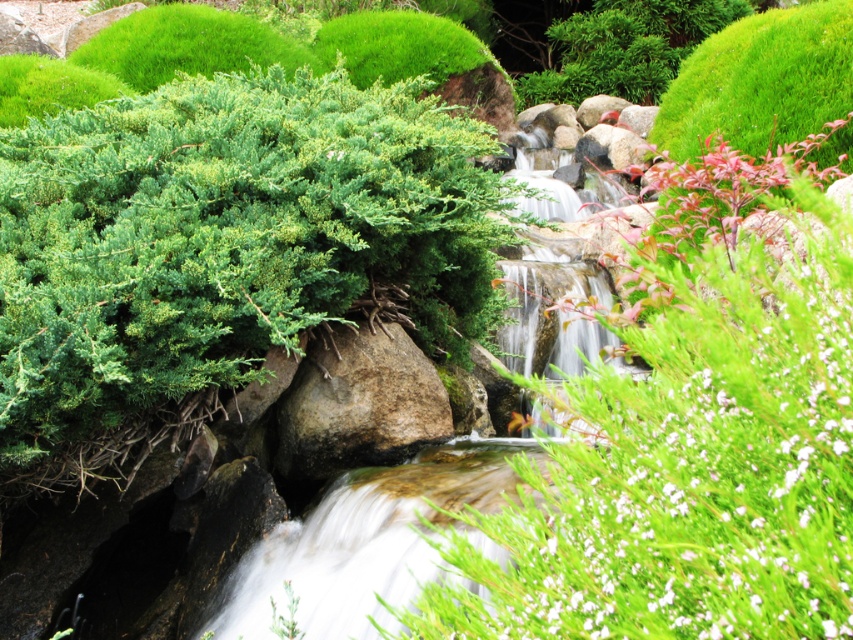
You are a gardener planning to place a decorative stone next to the green fuzzy bush at center and the brown rough rock at center. Based on their sizes, which object should you place the stone closer to to ensure it doesn not get overshadowed?

The green fuzzy bush at center might be wider than the brown rough rock at center, so placing the decorative stone closer to the brown rough rock at center would prevent it from being overshadowed by the larger bush.

You are a hiker who wants to take a photo of the brown rough rock at center without the green fuzzy bush at center blocking the view. Which direction should you move to get a clear shot?

The green fuzzy bush at center is much taller than the brown rough rock at center. To avoid the bush blocking the view of the rock, move to a position where the rock is not obscured by the bush, such as behind or to the side of the bush.

You are planning to place a small garden statue between the green leafy bush at left and the green fuzzy bush at center. Based on their widths, which bush should you position the statue closer to for better balance?

The green leafy bush at left has a lesser width compared to the green fuzzy bush at center, so positioning the statue closer to the green leafy bush at left would create a more balanced arrangement.